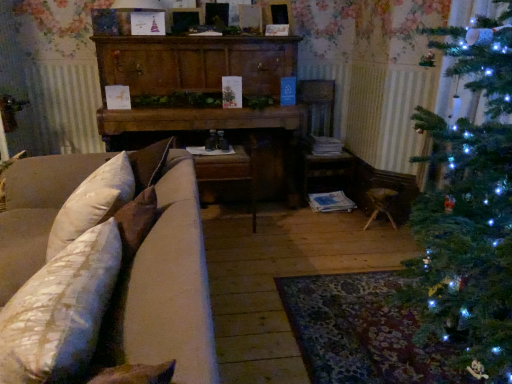
Question: Is wooden dresser at center positioned with its back to white textured pillow at lower left?

Choices:
 (A) yes
 (B) no

Answer: (B)

Question: Is wooden dresser at center wider than white textured pillow at lower left?

Choices:
 (A) no
 (B) yes

Answer: (B)

Question: From the image's perspective, is wooden dresser at center over white textured pillow at lower left?

Choices:
 (A) no
 (B) yes

Answer: (B)

Question: Does wooden dresser at center have a greater height compared to white textured pillow at lower left?

Choices:
 (A) no
 (B) yes

Answer: (B)

Question: Is wooden dresser at center to the right of white textured pillow at lower left from the viewer's perspective?

Choices:
 (A) no
 (B) yes

Answer: (B)

Question: Does wooden dresser at center appear on the left side of white textured pillow at lower left?

Choices:
 (A) no
 (B) yes

Answer: (A)

Question: Does beige fabric couch at left turn towards wooden armchair at center?

Choices:
 (A) no
 (B) yes

Answer: (A)

Question: Is beige fabric couch at left next to wooden armchair at center?

Choices:
 (A) no
 (B) yes

Answer: (A)

Question: Is beige fabric couch at left thinner than wooden armchair at center?

Choices:
 (A) yes
 (B) no

Answer: (B)

Question: From the image's perspective, would you say beige fabric couch at left is shown under wooden armchair at center?

Choices:
 (A) yes
 (B) no

Answer: (A)

Question: Can wooden armchair at center be found inside beige fabric couch at left?

Choices:
 (A) no
 (B) yes

Answer: (A)

Question: Does beige fabric couch at left have a greater height compared to wooden armchair at center?

Choices:
 (A) no
 (B) yes

Answer: (A)

Question: Are white textured pillow at lower left and wooden armchair at center located far from each other?

Choices:
 (A) no
 (B) yes

Answer: (B)